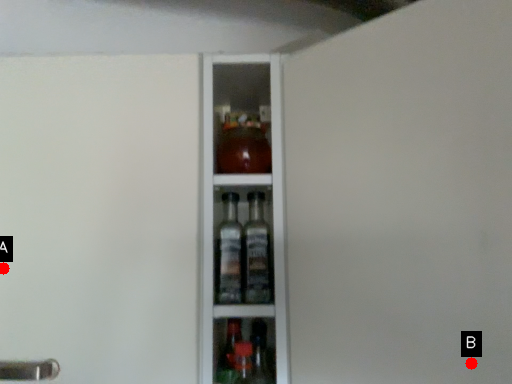
Question: Two points are circled on the image, labeled by A and B beside each circle. Which of the following is the closest to the observer?

Choices:
 (A) A is closer
 (B) B is closer

Answer: (B)